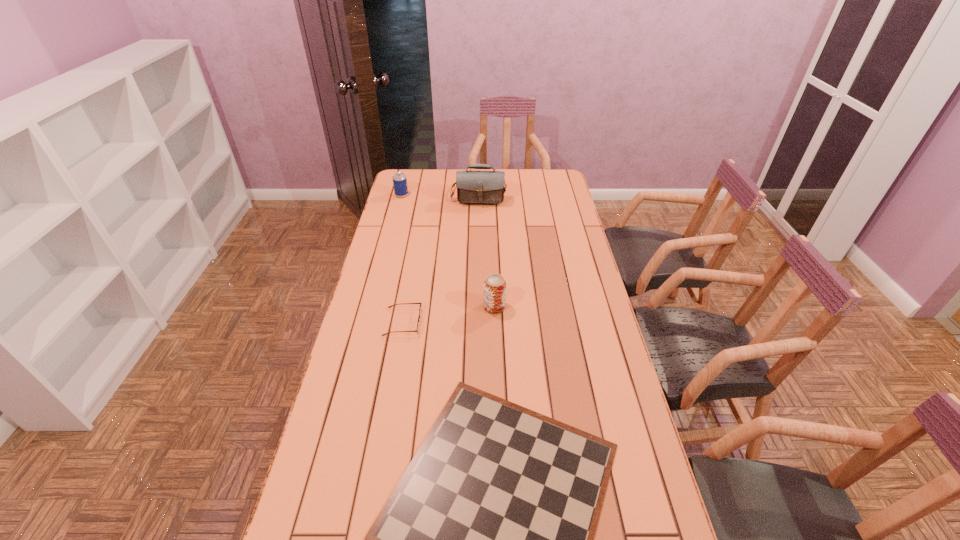
Find the location of a particular element. vacant point located between the shoulder bag and the right beer can is located at coordinates (487, 249).

Identify the location of vacant space that is in between the shortest object and the nearer beer can. (448, 314).

At what (x,y) coordinates should I click in order to perform the action: click on empty space between the tallest object and the third shortest object. Please return your answer as a coordinate pair (x, y). The width and height of the screenshot is (960, 540). Looking at the image, I should click on (441, 193).

This screenshot has width=960, height=540. I want to click on vacant point located between the spectacles and the farther beer can, so click(x=402, y=259).

This screenshot has height=540, width=960. I want to click on vacant space that is in between the leftmost object and the shoulder bag, so [441, 193].

Locate which object is the closest to the nearer beer can. Please provide its 2D coordinates. Your answer should be formatted as a tuple, i.e. [(x, y)], where the tuple contains the x and y coordinates of a point satisfying the conditions above.

[(419, 316)]

Choose which object is the fourth nearest neighbor to the leftmost object. Please provide its 2D coordinates. Your answer should be formatted as a tuple, i.e. [(x, y)], where the tuple contains the x and y coordinates of a point satisfying the conditions above.

[(487, 539)]

The image size is (960, 540). What are the coordinates of `free space that satisfies the following two spatial constraints: 1. on the front side of the right beer can; 2. on the front-facing side of the spectacles` in the screenshot? It's located at (495, 322).

The height and width of the screenshot is (540, 960). Identify the location of blank space that satisfies the following two spatial constraints: 1. on the front side of the shoulder bag; 2. on the left side of the nearer beer can. (478, 307).